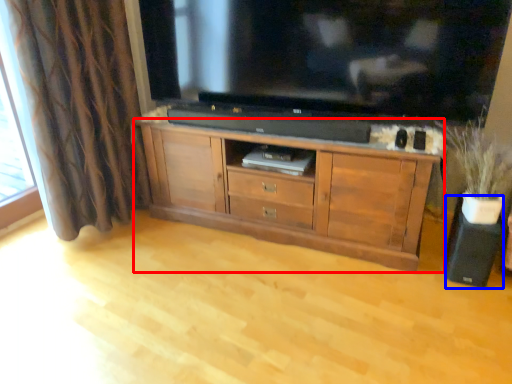
Question: Which object is further to the camera taking this photo, cabinetry (highlighted by a red box) or speaker (highlighted by a blue box)?

Choices:
 (A) cabinetry
 (B) speaker

Answer: (B)